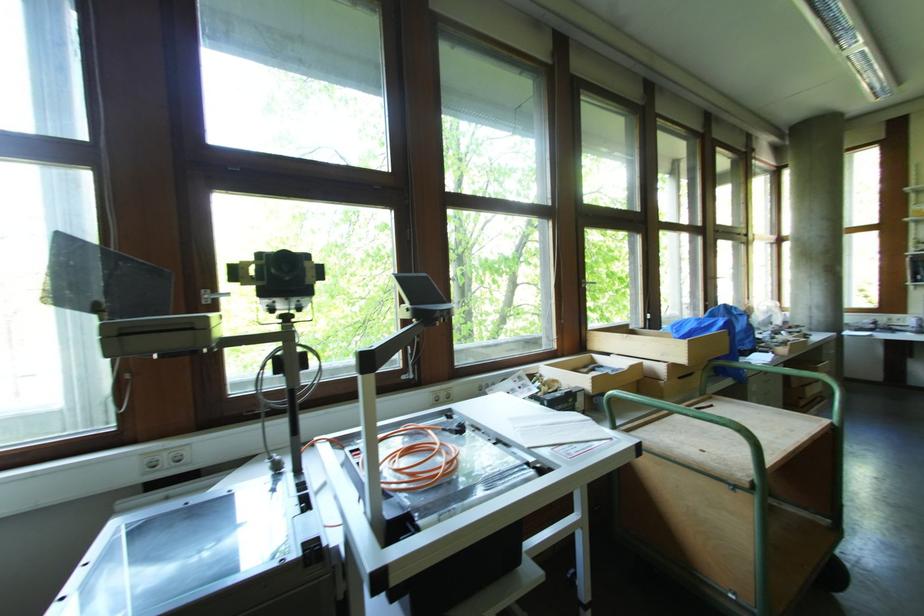
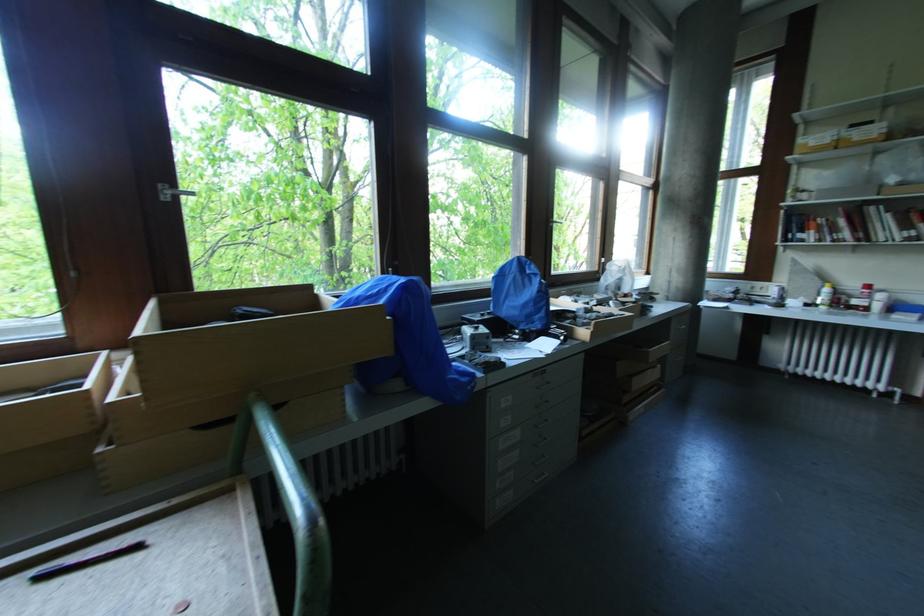
Find the pixel in the second image that matches point (586, 286) in the first image.

(167, 199)